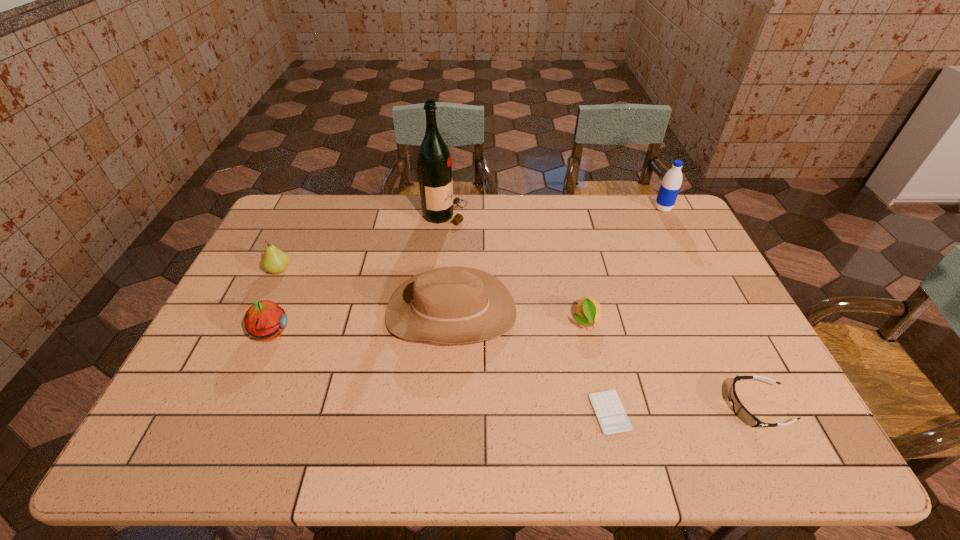
Locate an element on the screen. The width and height of the screenshot is (960, 540). goggles that is at the near edge is located at coordinates (742, 413).

Where is `calculator that is at the near edge`? Image resolution: width=960 pixels, height=540 pixels. calculator that is at the near edge is located at coordinates (607, 406).

This screenshot has height=540, width=960. What are the coordinates of `pear positioned at the left edge` in the screenshot? It's located at (275, 261).

Where is `apple that is at the left edge`? The width and height of the screenshot is (960, 540). apple that is at the left edge is located at coordinates (265, 320).

I want to click on water bottle situated at the right edge, so click(670, 186).

At what (x,y) coordinates should I click in order to perform the action: click on goggles that is at the right edge. Please return your answer as a coordinate pair (x, y). Looking at the image, I should click on (742, 413).

Find the location of a particular element. object that is at the far right corner is located at coordinates (670, 186).

Where is `object that is at the near right corner`? The height and width of the screenshot is (540, 960). object that is at the near right corner is located at coordinates (742, 413).

You are a GUI agent. You are given a task and a screenshot of the screen. Output one action in this format:
    pyautogui.click(x=<x>, y=<y>)
    Task: Click on the vacant region at the far edge of the desktop
    
    Given the screenshot: What is the action you would take?
    pyautogui.click(x=420, y=213)

In the image, there is a desktop. At what (x,y) coordinates should I click in order to perform the action: click on vacant space at the near edge. Please return your answer as a coordinate pair (x, y). The width and height of the screenshot is (960, 540). Looking at the image, I should click on (234, 455).